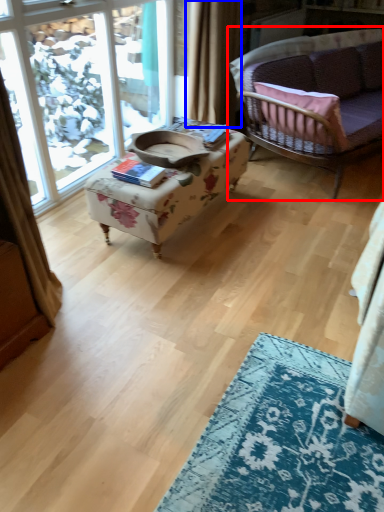
Question: Among these objects, which one is farthest to the camera, studio couch (highlighted by a red box) or curtain (highlighted by a blue box)?

Choices:
 (A) studio couch
 (B) curtain

Answer: (B)